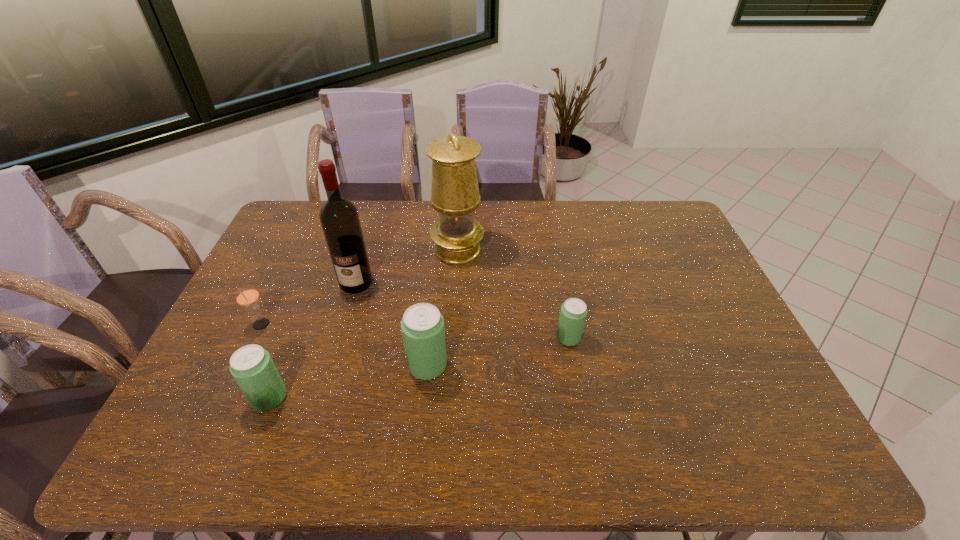
Considering the uniform spacing of sodas, where should an additional soda be positioned on the right? Please locate a free spot. Please provide its 2D coordinates. Your answer should be formatted as a tuple, i.e. [(x, y)], where the tuple contains the x and y coordinates of a point satisfying the conditions above.

[(694, 313)]